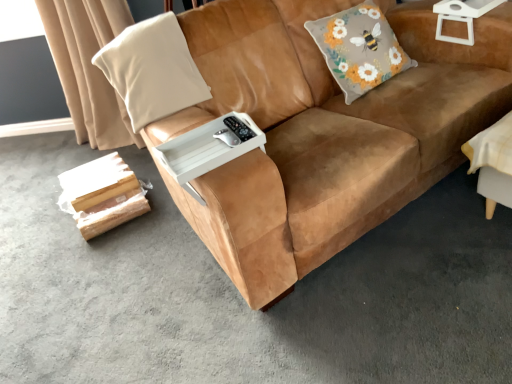
How much space does fluffy gray cushion with floral design at upper right, which ranks as the 2th throw pillow in left-to-right order, occupy horizontally?

fluffy gray cushion with floral design at upper right, which ranks as the 2th throw pillow in left-to-right order, is 13.88 inches wide.

Find the location of `fluffy gray cushion with floral design at upper right, which ranks as the 2th throw pillow in left-to-right order`. fluffy gray cushion with floral design at upper right, which ranks as the 2th throw pillow in left-to-right order is located at coordinates (359, 48).

Where is `white plastic side table at upper right`? white plastic side table at upper right is located at coordinates (461, 16).

The height and width of the screenshot is (384, 512). I want to click on suede brown couch at center, so click(325, 131).

You are a GUI agent. You are given a task and a screenshot of the screen. Output one action in this format:
    pyautogui.click(x=<x>, y=<y>)
    Task: Click on the fluffy gray cushion with floral design at upper right, acting as the 1th throw pillow starting from the right
    This screenshot has width=512, height=384.
    Given the screenshot: What is the action you would take?
    pyautogui.click(x=359, y=48)

Who is shorter, white plastic side table at upper right or beige fabric pillow at left, the second throw pillow when ordered from right to left?

Standing shorter between the two is white plastic side table at upper right.

Is point (463, 39) in front of point (142, 58)?

No, (463, 39) is behind (142, 58).

At what (x,y) coordinates should I click in order to perform the action: click on the 2nd throw pillow in front of the white plastic side table at upper right. Please return your answer as a coordinate pair (x, y). This screenshot has width=512, height=384. Looking at the image, I should click on (152, 70).

Would you say white plastic side table at upper right is inside or outside beige fabric pillow at left, the second throw pillow when ordered from right to left?

white plastic side table at upper right lies outside beige fabric pillow at left, the second throw pillow when ordered from right to left.

Find the location of `throw pillow above the beige fabric pillow at left, arranged as the first throw pillow when viewed from the left (from the image's perspective)`. throw pillow above the beige fabric pillow at left, arranged as the first throw pillow when viewed from the left (from the image's perspective) is located at coordinates (359, 48).

Consider the image. Is beige fabric pillow at left, the second throw pillow when ordered from right to left, far from fluffy gray cushion with floral design at upper right, which ranks as the 2th throw pillow in left-to-right order?

No.

From a real-world perspective, who is located lower, beige fabric pillow at left, the second throw pillow when ordered from right to left, or fluffy gray cushion with floral design at upper right, acting as the 1th throw pillow starting from the right?

fluffy gray cushion with floral design at upper right, acting as the 1th throw pillow starting from the right, is physically lower.

Considering the positions of point (77, 133) and point (358, 33), is point (77, 133) closer or farther from the camera than point (358, 33)?

Point (77, 133) is positioned farther from the camera compared to point (358, 33).

Which is correct: beige fabric curtain at upper left is inside fluffy gray cushion with floral design at upper right, which ranks as the 2th throw pillow in left-to-right order, or outside of it?

beige fabric curtain at upper left is located beyond the bounds of fluffy gray cushion with floral design at upper right, which ranks as the 2th throw pillow in left-to-right order.

Which of these two, beige fabric curtain at upper left or fluffy gray cushion with floral design at upper right, acting as the 1th throw pillow starting from the right, stands shorter?

Standing shorter between the two is fluffy gray cushion with floral design at upper right, acting as the 1th throw pillow starting from the right.

Could you tell me if beige fabric curtain at upper left is turned towards fluffy gray cushion with floral design at upper right, which ranks as the 2th throw pillow in left-to-right order?

No, beige fabric curtain at upper left is not oriented towards fluffy gray cushion with floral design at upper right, which ranks as the 2th throw pillow in left-to-right order.

Considering the sizes of objects beige fabric pillow at left, arranged as the first throw pillow when viewed from the left, and white plastic tray at center in the image provided, who is wider, beige fabric pillow at left, arranged as the first throw pillow when viewed from the left, or white plastic tray at center?

beige fabric pillow at left, arranged as the first throw pillow when viewed from the left, is wider.

Could you tell me if beige fabric pillow at left, arranged as the first throw pillow when viewed from the left, is facing white plastic tray at center?

Yes, beige fabric pillow at left, arranged as the first throw pillow when viewed from the left, is oriented towards white plastic tray at center.

Is beige fabric pillow at left, the second throw pillow when ordered from right to left, far away from white plastic tray at center?

No, beige fabric pillow at left, the second throw pillow when ordered from right to left, is not far from white plastic tray at center.

Considering the positions of objects beige fabric pillow at left, arranged as the first throw pillow when viewed from the left, and white plastic tray at center in the image provided, who is in front, beige fabric pillow at left, arranged as the first throw pillow when viewed from the left, or white plastic tray at center?

white plastic tray at center.

Which object is thinner, fluffy gray cushion with floral design at upper right, which ranks as the 2th throw pillow in left-to-right order, or white plastic tray at center?

white plastic tray at center is thinner.

Can we say fluffy gray cushion with floral design at upper right, which ranks as the 2th throw pillow in left-to-right order, lies outside white plastic tray at center?

Yes.

Between fluffy gray cushion with floral design at upper right, which ranks as the 2th throw pillow in left-to-right order, and white plastic tray at center, which one is positioned behind?

fluffy gray cushion with floral design at upper right, which ranks as the 2th throw pillow in left-to-right order.

From the image's perspective, is suede brown couch at center above beige fabric pillow at left, arranged as the first throw pillow when viewed from the left?

Actually, suede brown couch at center appears below beige fabric pillow at left, arranged as the first throw pillow when viewed from the left, in the image.

Consider the image. From a real-world perspective, is suede brown couch at center located higher than beige fabric pillow at left, the second throw pillow when ordered from right to left?

Incorrect, from a real-world perspective, suede brown couch at center is lower than beige fabric pillow at left, the second throw pillow when ordered from right to left.

Considering the relative sizes of suede brown couch at center and beige fabric pillow at left, arranged as the first throw pillow when viewed from the left, in the image provided, is suede brown couch at center smaller than beige fabric pillow at left, arranged as the first throw pillow when viewed from the left,?

No, suede brown couch at center is not smaller than beige fabric pillow at left, arranged as the first throw pillow when viewed from the left.

Consider the image. Which of these two, suede brown couch at center or beige fabric pillow at left, arranged as the first throw pillow when viewed from the left, stands taller?

Standing taller between the two is suede brown couch at center.

This screenshot has width=512, height=384. Find the location of `side table behind the white plastic tray at center`. side table behind the white plastic tray at center is located at coordinates (461, 16).

From their relative heights in the image, would you say white plastic tray at center is taller or shorter than white plastic side table at upper right?

In the image, white plastic tray at center appears to be shorter than white plastic side table at upper right.

Is white plastic tray at center completely or partially outside of white plastic side table at upper right?

Yes, white plastic tray at center is outside of white plastic side table at upper right.

Looking at this image, is white plastic tray at center far from white plastic side table at upper right?

white plastic tray at center is far away from white plastic side table at upper right.

At what (x,y) coordinates should I click in order to perform the action: click on the 2nd throw pillow below the white plastic side table at upper right (from the image's perspective). Please return your answer as a coordinate pair (x, y). Looking at the image, I should click on (152, 70).

Find the location of a particular element. throw pillow to the right of beige fabric pillow at left, arranged as the first throw pillow when viewed from the left is located at coordinates (359, 48).

From the image, which object appears to be nearer to white plastic side table at upper right, fluffy gray cushion with floral design at upper right, acting as the 1th throw pillow starting from the right, or suede brown couch at center?

fluffy gray cushion with floral design at upper right, acting as the 1th throw pillow starting from the right, is positioned closer to the anchor white plastic side table at upper right.

Looking at this image, based on their spatial positions, is fluffy gray cushion with floral design at upper right, which ranks as the 2th throw pillow in left-to-right order, or beige fabric pillow at left, the second throw pillow when ordered from right to left, further from white plastic tray at center?

Among the two, fluffy gray cushion with floral design at upper right, which ranks as the 2th throw pillow in left-to-right order, is located further to white plastic tray at center.

From the image, which object appears to be farther from suede brown couch at center, beige fabric pillow at left, arranged as the first throw pillow when viewed from the left, or white plastic side table at upper right?

white plastic side table at upper right lies further to suede brown couch at center than the other object.

From the image, which object appears to be farther from beige fabric curtain at upper left, beige fabric pillow at left, the second throw pillow when ordered from right to left, or white plastic side table at upper right?

white plastic side table at upper right is further to beige fabric curtain at upper left.

Estimate the real-world distances between objects in this image. Which object is closer to beige fabric curtain at upper left, beige fabric pillow at left, arranged as the first throw pillow when viewed from the left, or fluffy gray cushion with floral design at upper right, which ranks as the 2th throw pillow in left-to-right order?

Among the two, beige fabric pillow at left, arranged as the first throw pillow when viewed from the left, is located nearer to beige fabric curtain at upper left.

Estimate the real-world distances between objects in this image. Which object is closer to beige fabric pillow at left, arranged as the first throw pillow when viewed from the left, suede brown couch at center or white plastic tray at center?

suede brown couch at center is positioned closer to the anchor beige fabric pillow at left, arranged as the first throw pillow when viewed from the left.

From the image, which object appears to be nearer to beige fabric pillow at left, the second throw pillow when ordered from right to left, white plastic tray at center or white plastic side table at upper right?

white plastic tray at center.

Considering their positions, is beige fabric pillow at left, the second throw pillow when ordered from right to left, positioned further to suede brown couch at center than fluffy gray cushion with floral design at upper right, which ranks as the 2th throw pillow in left-to-right order?

Based on the image, beige fabric pillow at left, the second throw pillow when ordered from right to left, appears to be further to suede brown couch at center.

Locate an element on the screen. The width and height of the screenshot is (512, 384). studio couch between beige fabric curtain at upper left and white plastic side table at upper right from left to right is located at coordinates (325, 131).

This screenshot has width=512, height=384. In order to click on table between beige fabric pillow at left, the second throw pillow when ordered from right to left, and fluffy gray cushion with floral design at upper right, acting as the 1th throw pillow starting from the right, from left to right in this screenshot , I will do `click(209, 148)`.

This screenshot has width=512, height=384. What are the coordinates of `studio couch between beige fabric pillow at left, arranged as the first throw pillow when viewed from the left, and fluffy gray cushion with floral design at upper right, which ranks as the 2th throw pillow in left-to-right order, in the horizontal direction` in the screenshot? It's located at (x=325, y=131).

Find the location of a particular element. Image resolution: width=512 pixels, height=384 pixels. table between beige fabric pillow at left, arranged as the first throw pillow when viewed from the left, and white plastic side table at upper right from left to right is located at coordinates (209, 148).